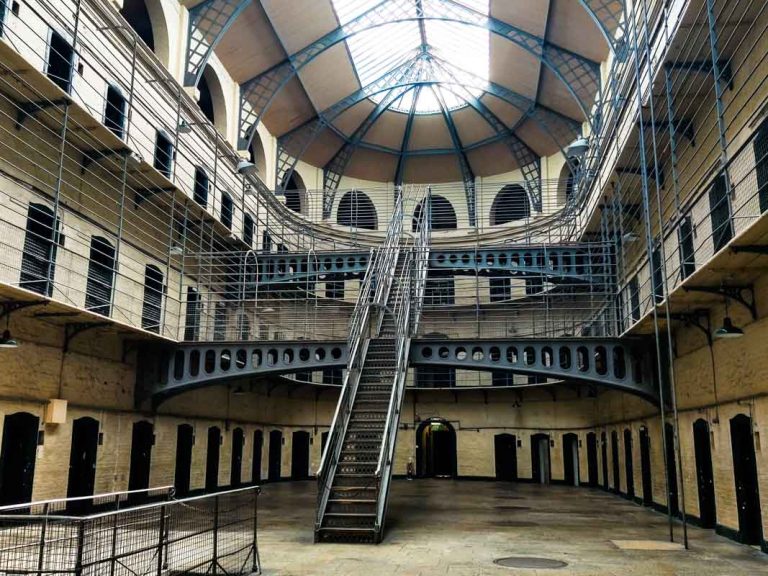
Locate an element on the screen. This screenshot has width=768, height=576. light fixtures is located at coordinates (733, 335), (10, 340).